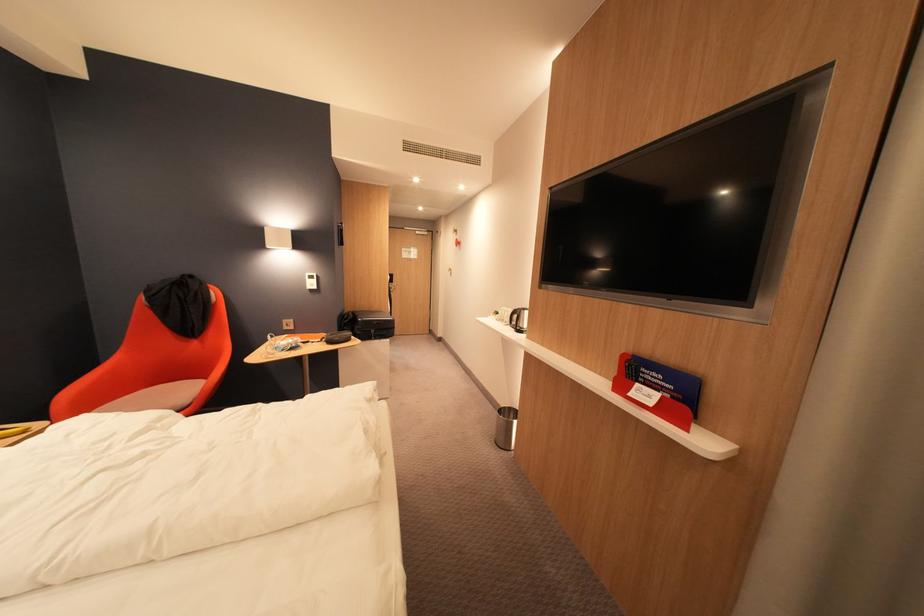
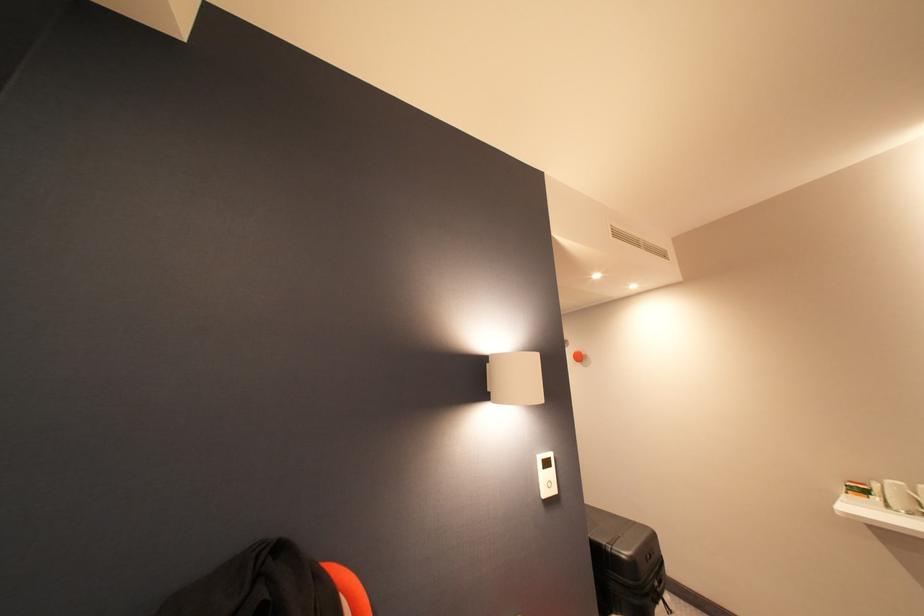
Which direction would the cameraman need to move to produce the second image?

The cameraman moved toward left, forward.